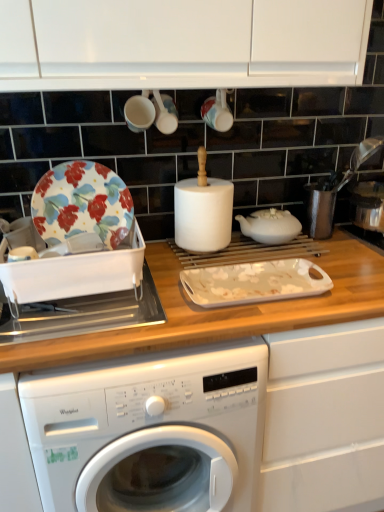
The image size is (384, 512). In order to click on free space above wooden at center (from a real-world perspective) in this screenshot , I will do `click(161, 281)`.